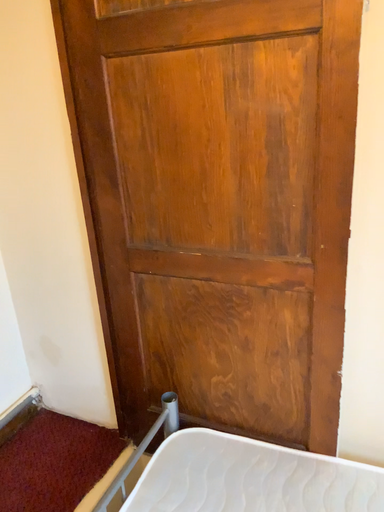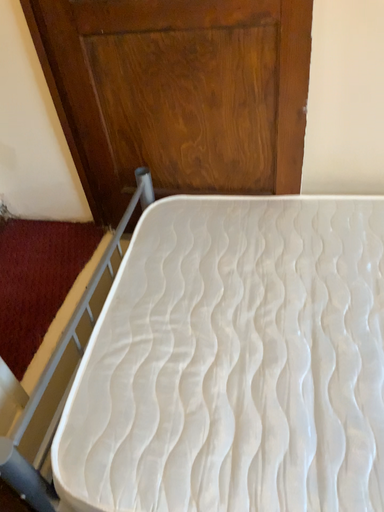
Question: How did the camera likely rotate when shooting the video?

Choices:
 (A) rotated downward
 (B) rotated upward

Answer: (A)